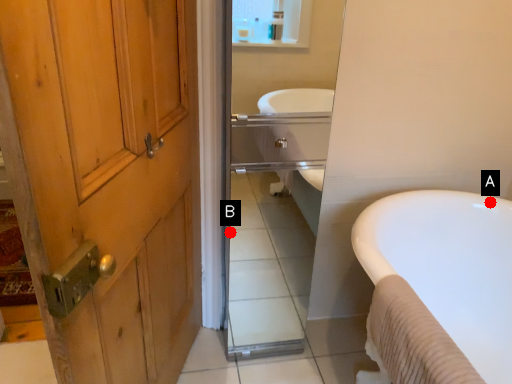
Question: Two points are circled on the image, labeled by A and B beside each circle. Which point is further to the camera?

Choices:
 (A) A is further
 (B) B is further

Answer: (B)